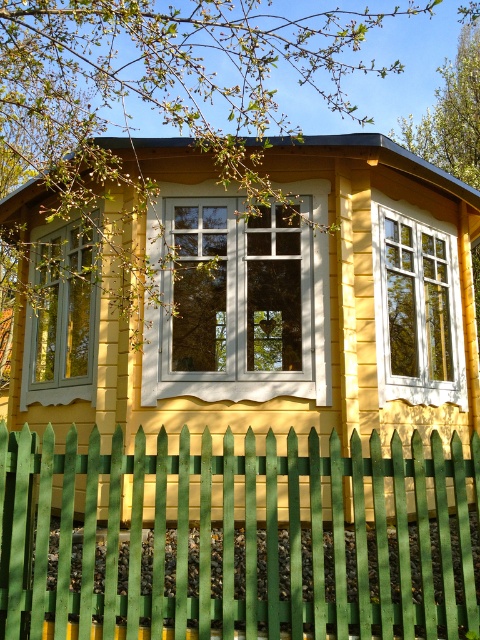
Between green wooden fence at lower center and white painted wood window at center, which one is positioned higher?

white painted wood window at center

Between point (166, 604) and point (207, 285), which one is positioned in front?

Point (166, 604)

Locate an element on the screen. Image resolution: width=480 pixels, height=640 pixels. green wooden fence at lower center is located at coordinates (238, 540).

Identify the location of green wooden fence at lower center. (238, 540).

From the picture: Does white painted wood window at center have a larger size compared to white wood window at center?

Actually, white painted wood window at center might be smaller than white wood window at center.

Where is `white painted wood window at center`? white painted wood window at center is located at coordinates (238, 292).

Find the location of a particular element. white painted wood window at center is located at coordinates (238, 292).

Measure the distance between green wooden fence at lower center and camera.

They are 3.36 meters apart.

Consider the image. Is green wooden fence at lower center below white wood window at center?

Yes.

The width and height of the screenshot is (480, 640). Describe the element at coordinates (238, 540) in the screenshot. I see `green wooden fence at lower center` at that location.

Locate an element on the screen. Image resolution: width=480 pixels, height=640 pixels. green wooden fence at lower center is located at coordinates (238, 540).